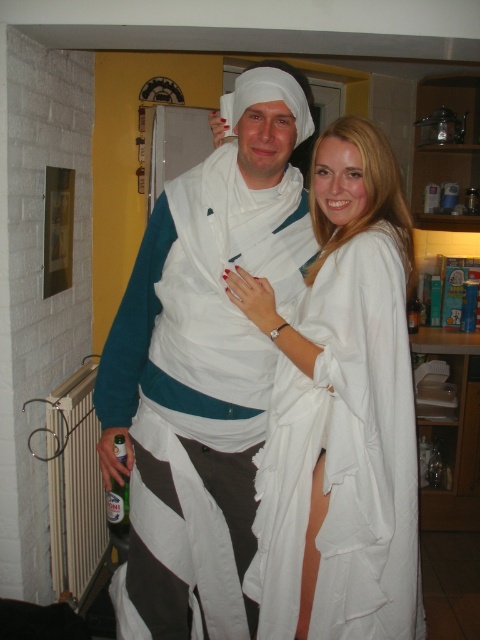
You are a photographer setting up for a photoshoot. You need to position the white cotton toga at center and the white fabric dress at center so that they are exactly 20 centimeters apart. Based on their current positions, do you need to move them closer or farther apart?

The white cotton toga at center is currently 17.41 centimeters away from the white fabric dress at center. To reach the desired 20 centimeters, you need to move them farther apart by approximately 2.59 centimeters.